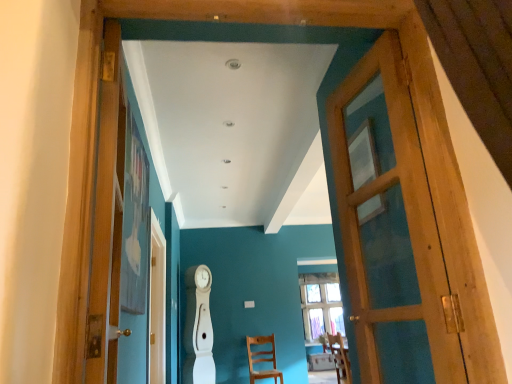
Question: Does wooden door at right, which is counted as the first door, starting from the right, have a lesser width compared to wooden chair at center, the first chair from the right?

Choices:
 (A) no
 (B) yes

Answer: (B)

Question: Could wooden chair at center, which appears as the first chair when viewed from the front, be considered to be inside wooden door at right, acting as the second door starting from the left?

Choices:
 (A) yes
 (B) no

Answer: (B)

Question: Can you confirm if wooden door at right, which is counted as the first door, starting from the right, is smaller than wooden chair at center, the first chair from the right?

Choices:
 (A) yes
 (B) no

Answer: (A)

Question: Can you confirm if wooden door at right, which is counted as the first door, starting from the right, is shorter than wooden chair at center, marked as the second chair in a back-to-front arrangement?

Choices:
 (A) no
 (B) yes

Answer: (A)

Question: Is wooden door at right, which is counted as the first door, starting from the right, bigger than wooden chair at center, acting as the 2th chair starting from the bottom?

Choices:
 (A) no
 (B) yes

Answer: (A)

Question: Looking at the image, does wooden door at right, which is counted as the first door, starting from the right, seem bigger or smaller compared to wooden chair at center, the first chair positioned from the back?

Choices:
 (A) small
 (B) big

Answer: (A)

Question: Considering the positions of point (373, 130) and point (251, 339), is point (373, 130) closer or farther from the camera than point (251, 339)?

Choices:
 (A) farther
 (B) closer

Answer: (B)

Question: From the image's perspective, relative to wooden chair at center, which is counted as the 1th chair, starting from the bottom, is wooden door at right, acting as the second door starting from the left, above or below?

Choices:
 (A) above
 (B) below

Answer: (A)

Question: Choose the correct answer: Is wooden door at right, acting as the second door starting from the left, inside wooden chair at center, the second chair from the front, or outside it?

Choices:
 (A) inside
 (B) outside

Answer: (B)

Question: In the image, is wooden door at left, the second door positioned from the right, on the left side or the right side of wooden chair at center, arranged as the second chair when viewed from the left?

Choices:
 (A) right
 (B) left

Answer: (B)

Question: Is wooden door at left, the second door positioned from the right, spatially inside wooden chair at center, acting as the 2th chair starting from the bottom, or outside of it?

Choices:
 (A) outside
 (B) inside

Answer: (A)

Question: From a real-world perspective, relative to wooden chair at center, arranged as the second chair when viewed from the left, is wooden door at left, marked as the 1th door in a left-to-right arrangement, vertically above or below?

Choices:
 (A) below
 (B) above

Answer: (B)

Question: Is wooden door at left, marked as the 1th door in a left-to-right arrangement, wider or thinner than wooden chair at center, acting as the 2th chair starting from the bottom?

Choices:
 (A) wide
 (B) thin

Answer: (B)

Question: Considering the positions of point [x=261, y=360] and point [x=388, y=263], is point [x=261, y=360] closer or farther from the camera than point [x=388, y=263]?

Choices:
 (A) farther
 (B) closer

Answer: (A)

Question: Relative to wooden door at right, acting as the second door starting from the left, is wooden chair at center, the second chair from the front, in front or behind?

Choices:
 (A) front
 (B) behind

Answer: (B)